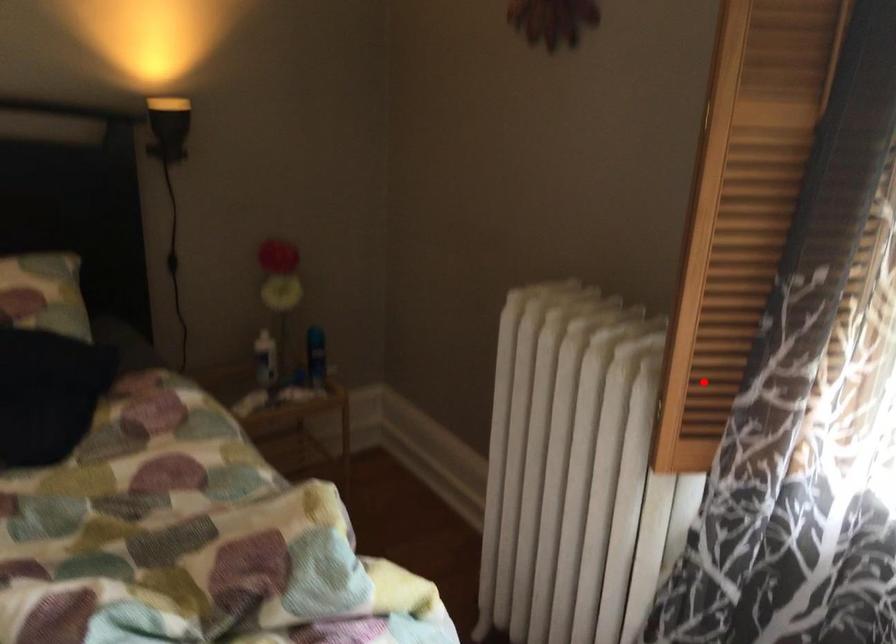
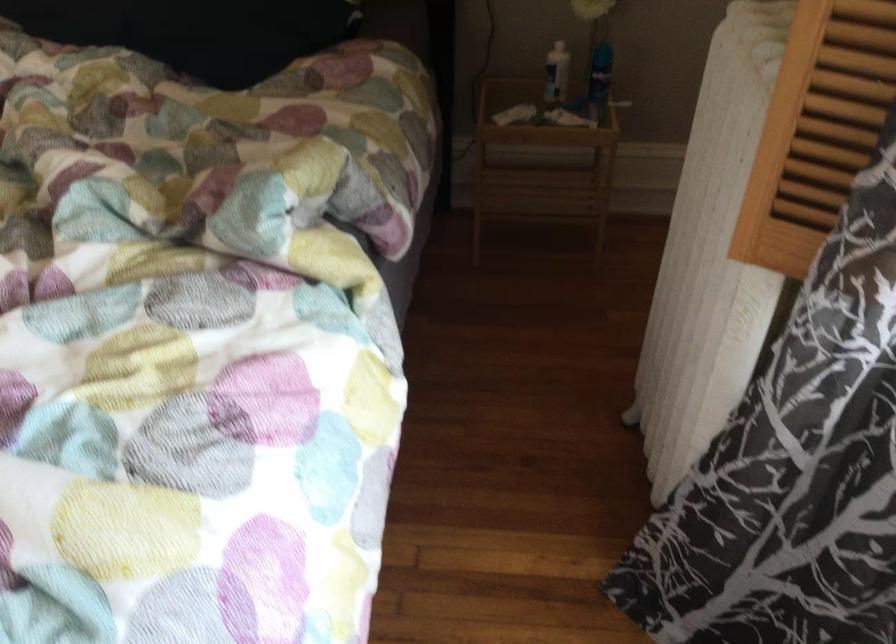
Find the pixel in the second image that matches the highlighted location in the first image.

(815, 129)